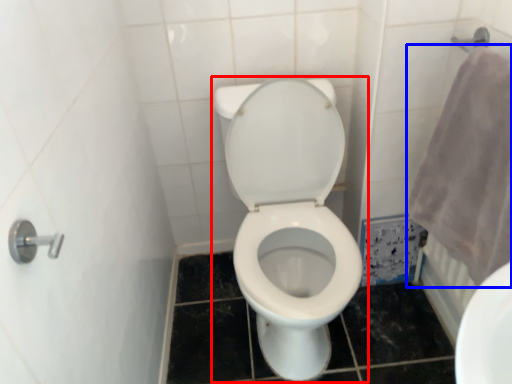
Question: Which object appears closest to the camera in this image, toilet (highlighted by a red box) or bath towel (highlighted by a blue box)?

Choices:
 (A) toilet
 (B) bath towel

Answer: (B)